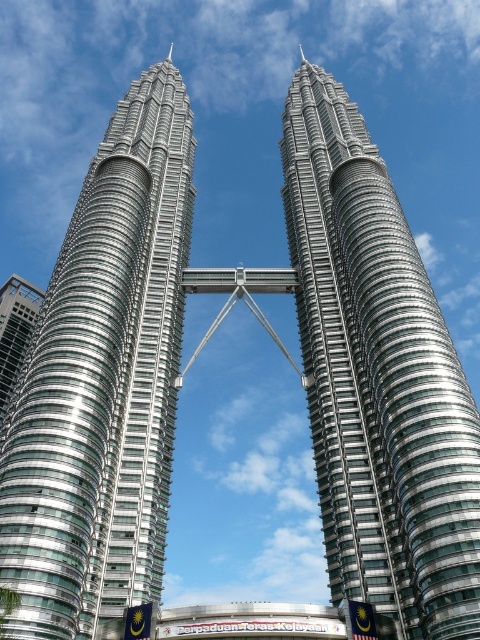
You are standing on the ground floor of the glassy steel skyscraper at left and want to walk to the silver glass skyscraper at center. Which direction should you move to reach it?

You should move to the right to reach the silver glass skyscraper at center because it is positioned to the right of the glassy steel skyscraper at left.

From the picture: You are standing in the plaza below the towers and want to take a photo that captures both the silver metallic twin towers at left and the silver glass skyscraper at center. Which tower should you position closer to in order to include both structures in the frame without cropping?

The silver metallic twin towers at left are taller than the silver glass skyscraper at center. To include both in the frame without cropping, you should position yourself closer to the silver glass skyscraper at center since it is shorter, allowing the taller twin towers to still be visible in the background.

You are standing at the base of the Petronas Twin Towers and looking up. You notice a point marked at coordinates (377, 378). Which structure does this point belong to?

The point at (377, 378) is on the silver glass skyscraper at center.